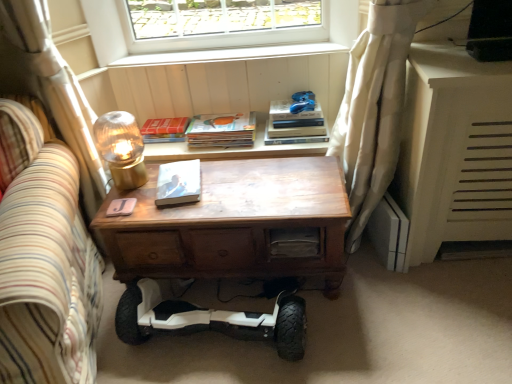
Image resolution: width=512 pixels, height=384 pixels. I want to click on vacant area in front of translucent glass lampshade at upper left, so click(x=136, y=205).